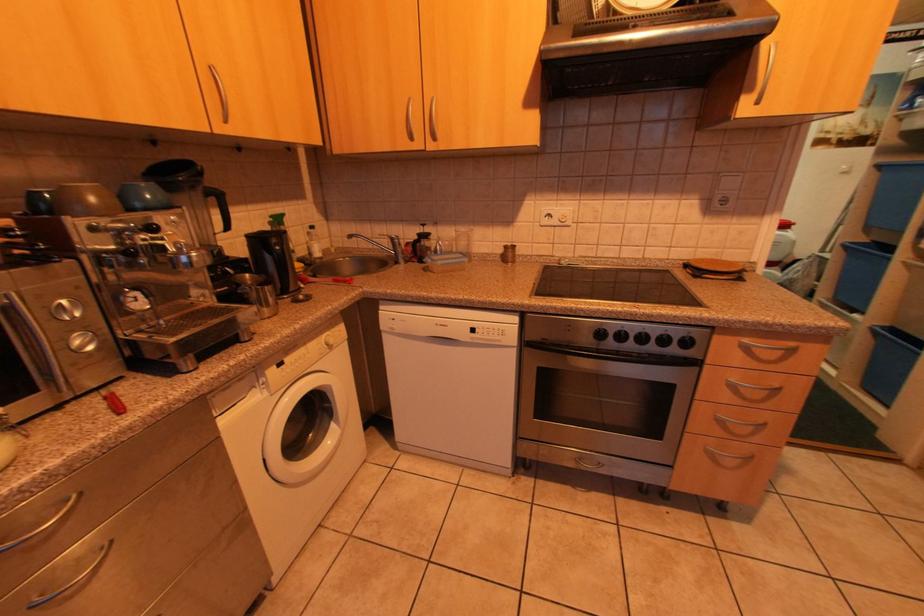
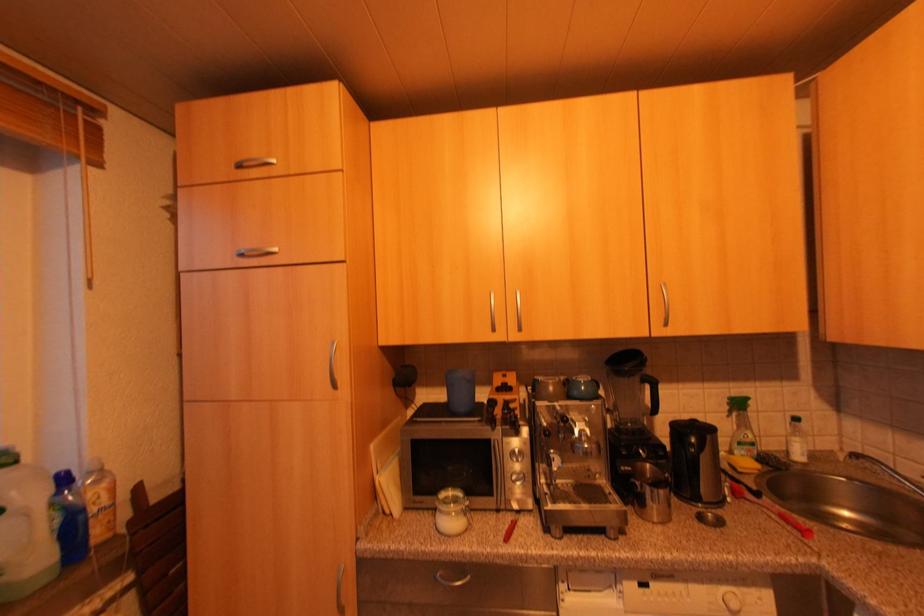
Question: Based on the continuous images, in which direction is the camera rotating? Reply with the corresponding letter.

Choices:
 (A) Left
 (B) Right
 (C) Up
 (D) Down

Answer: (A)